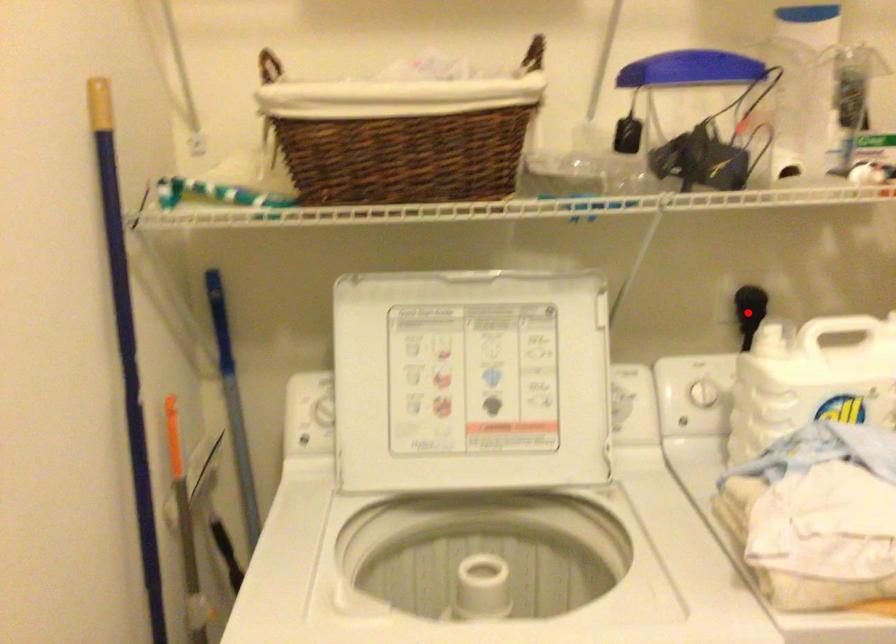
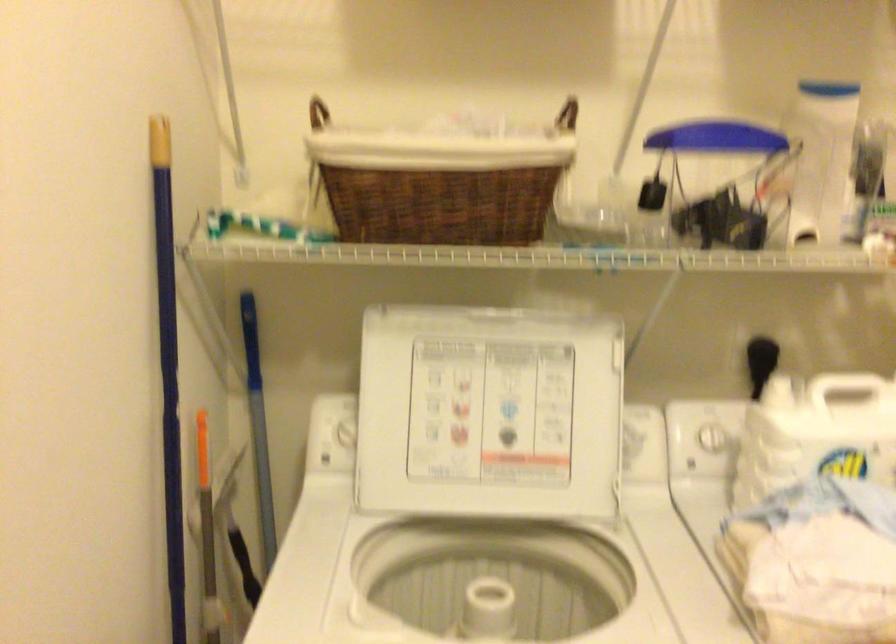
Find the pixel in the second image that matches the highlighted location in the first image.

(760, 362)